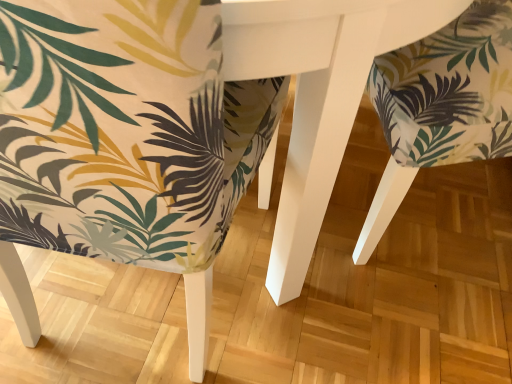
Question: Is matte fabric chair at right, the second chair from the left, to the left or to the right of printed fabric chair at center, acting as the first chair starting from the left, in the image?

Choices:
 (A) left
 (B) right

Answer: (B)

Question: Looking at their shapes, would you say matte fabric chair at right, the second chair from the left, is wider or thinner than printed fabric chair at center, acting as the first chair starting from the left?

Choices:
 (A) thin
 (B) wide

Answer: (B)

Question: From the image's perspective, relative to printed fabric chair at center, acting as the first chair starting from the left, is matte fabric chair at right, the second chair from the left, above or below?

Choices:
 (A) above
 (B) below

Answer: (A)

Question: Considering the positions of printed fabric chair at center, acting as the first chair starting from the left, and matte fabric chair at right, the second chair from the left, in the image, is printed fabric chair at center, acting as the first chair starting from the left, wider or thinner than matte fabric chair at right, the second chair from the left,?

Choices:
 (A) wide
 (B) thin

Answer: (B)

Question: Considering the positions of printed fabric chair at center, acting as the first chair starting from the left, and matte fabric chair at right, which is counted as the 1th chair, starting from the right, in the image, is printed fabric chair at center, acting as the first chair starting from the left, bigger or smaller than matte fabric chair at right, which is counted as the 1th chair, starting from the right,?

Choices:
 (A) small
 (B) big

Answer: (B)

Question: Based on their positions, is printed fabric chair at center, acting as the first chair starting from the left, located to the left or right of matte fabric chair at right, which is counted as the 1th chair, starting from the right?

Choices:
 (A) left
 (B) right

Answer: (A)

Question: From the image's perspective, is printed fabric chair at center, arranged as the 2th chair when viewed from the right, above or below matte fabric chair at right, the second chair from the left?

Choices:
 (A) above
 (B) below

Answer: (B)